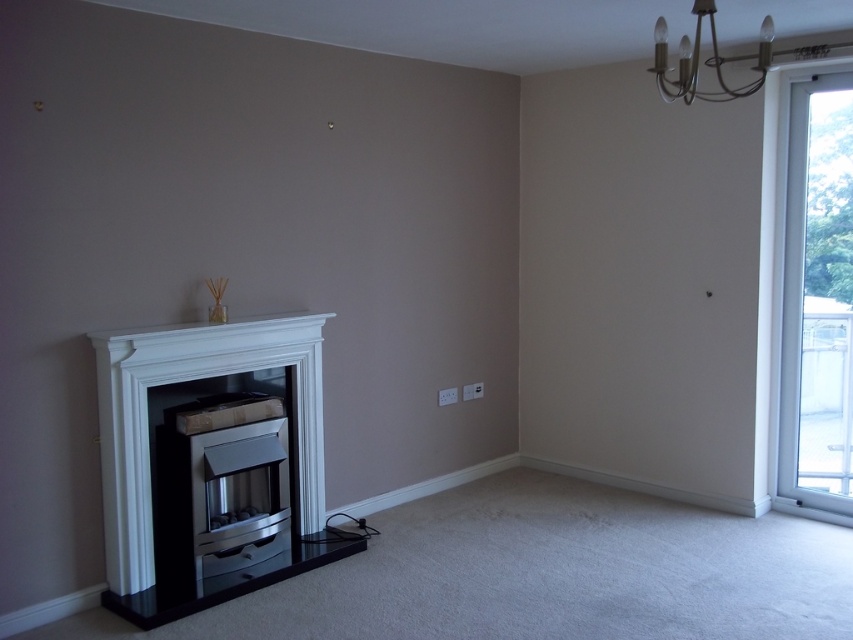
You are designing a room layout and need to place a tall floor lamp. The lamp is 2 meters tall. You have two options for placement next to either the white glossy fireplace at left or the clear glass window at right. Based on their heights, which object can accommodate the lamp without blocking the view or causing obstruction?

The clear glass window at right is taller than the white glossy fireplace at left. Since the lamp is 2 meters tall, placing it next to the taller clear glass window at right would be more appropriate to avoid blocking the view or causing obstruction.

You are standing in the living room and want to place a new painting on the wall. The painting requires a hook that must be placed exactly at the center of the wall. Given the coordinates of the white glossy fireplace at left, can you determine if the fireplace is positioned to the left or right of the wall center?

The white glossy fireplace at left is located at coordinates point (210,461). Since the x coordinate is 0.722, which is greater than 0.5, the fireplace is positioned to the right of the wall center.

You are standing in the living room and want to place a 3.5 feet wide painting on the wall directly in front of the white glossy fireplace at left. Can the painting fit horizontally on the fireplace?

The white glossy fireplace at left is 10.47 feet away from the viewer. The painting is 3.5 feet wide. Since the distance is sufficient, the painting can be placed horizontally on the fireplace as there is enough space.